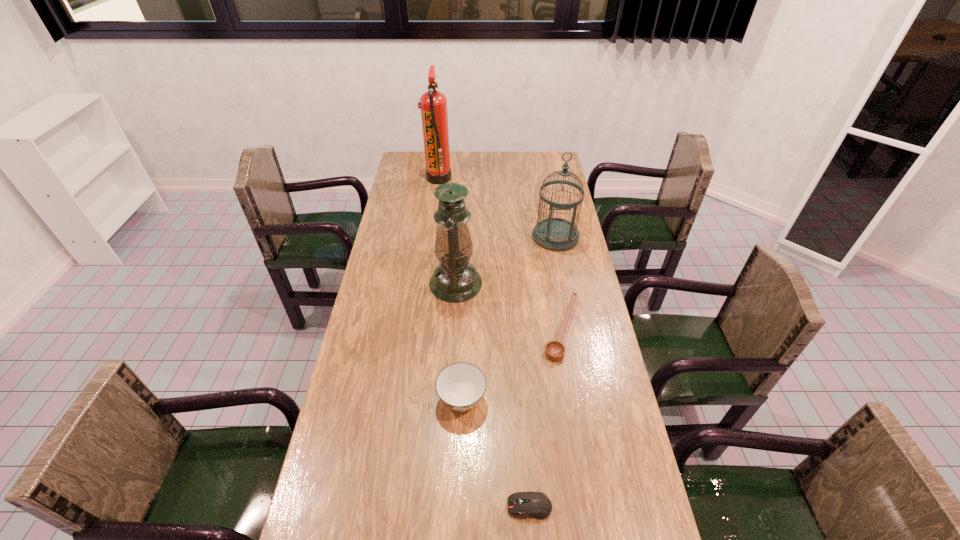
Identify the location of the farthest object. (433, 104).

Where is `oil lamp`? The image size is (960, 540). oil lamp is located at coordinates (455, 280).

What are the coordinates of `birdcage` in the screenshot? It's located at (554, 234).

At what (x,y) coordinates should I click in order to perform the action: click on the fourth tallest object. Please return your answer as a coordinate pair (x, y). Looking at the image, I should click on (460, 386).

Where is `the second nearest object`? This screenshot has width=960, height=540. the second nearest object is located at coordinates (460, 386).

Where is `wooden spoon`? The height and width of the screenshot is (540, 960). wooden spoon is located at coordinates (555, 350).

Find the location of a particular element. This screenshot has width=960, height=540. computer equipment is located at coordinates (533, 504).

You are a GUI agent. You are given a task and a screenshot of the screen. Output one action in this format:
    pyautogui.click(x=<x>, y=<y>)
    Task: Click on the nearest object
    The height and width of the screenshot is (540, 960).
    Given the screenshot: What is the action you would take?
    pyautogui.click(x=533, y=504)

Image resolution: width=960 pixels, height=540 pixels. What are the coordinates of `vacant space located 0.310m with the nozzle pointing from the back of the farthest object` in the screenshot? It's located at (516, 178).

Locate an element on the screen. This screenshot has width=960, height=540. vacant region located 0.070m on the right of the oil lamp is located at coordinates (502, 284).